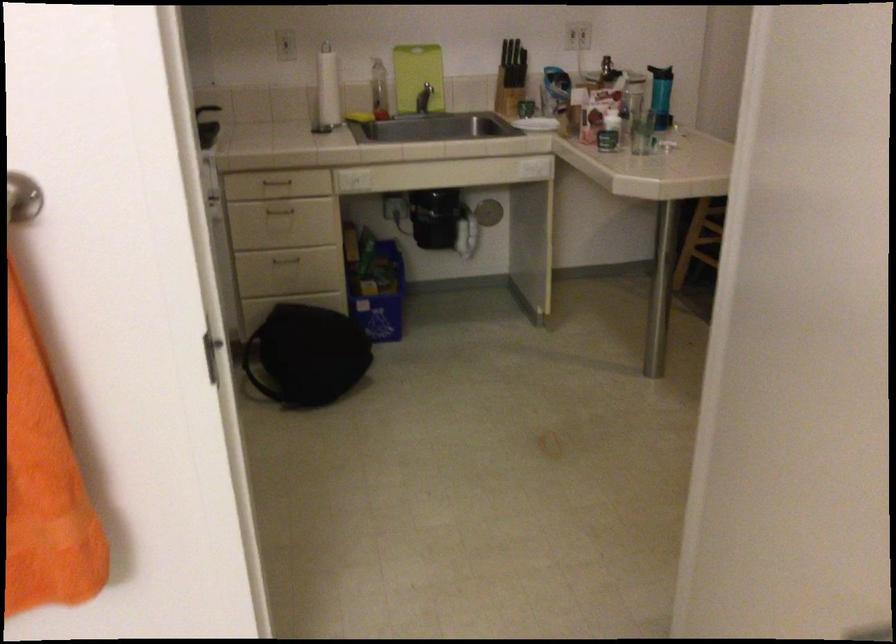
Find where to lift the blue recycling bin. Please return your answer as a coordinate pair (x, y).

(380, 292)